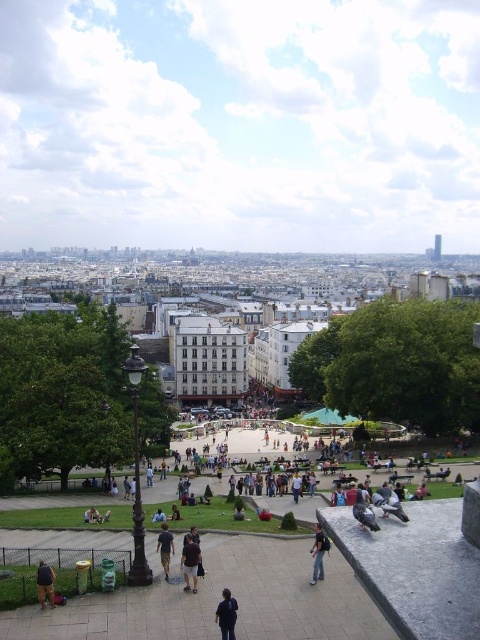
Question: Which object is closer to the camera taking this photo?

Choices:
 (A) dark blue shirt at center
 (B) jeans at lower center
 (C) dark brown leather jacket at center
 (D) brown leather jacket at lower left

Answer: (D)

Question: Which of the following is the farthest from the observer?

Choices:
 (A) (194, 588)
 (B) (162, 547)

Answer: (B)

Question: In this image, where is dark blue shirt at center located relative to dark blue fabric at lower center?

Choices:
 (A) below
 (B) above

Answer: (B)

Question: In this image, where is dark blue shirt at center located relative to dark brown leather jacket at center?

Choices:
 (A) above
 (B) below

Answer: (A)

Question: Among these objects, which one is nearest to the camera?

Choices:
 (A) dark blue fabric at lower center
 (B) dark brown leather jacket at center

Answer: (A)

Question: Does dark blue fabric at lower center have a larger size compared to dark brown leather jacket at center?

Choices:
 (A) yes
 (B) no

Answer: (B)